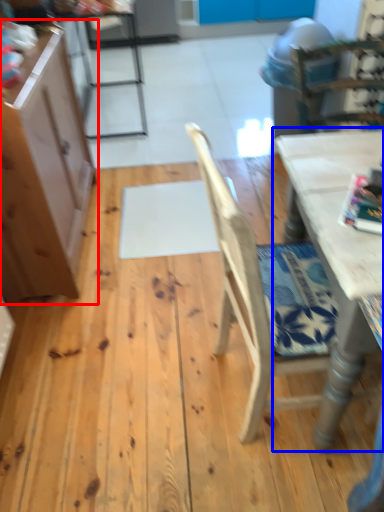
Question: Which of the following is the farthest to the observer, cabinetry (highlighted by a red box) or table (highlighted by a blue box)?

Choices:
 (A) cabinetry
 (B) table

Answer: (A)